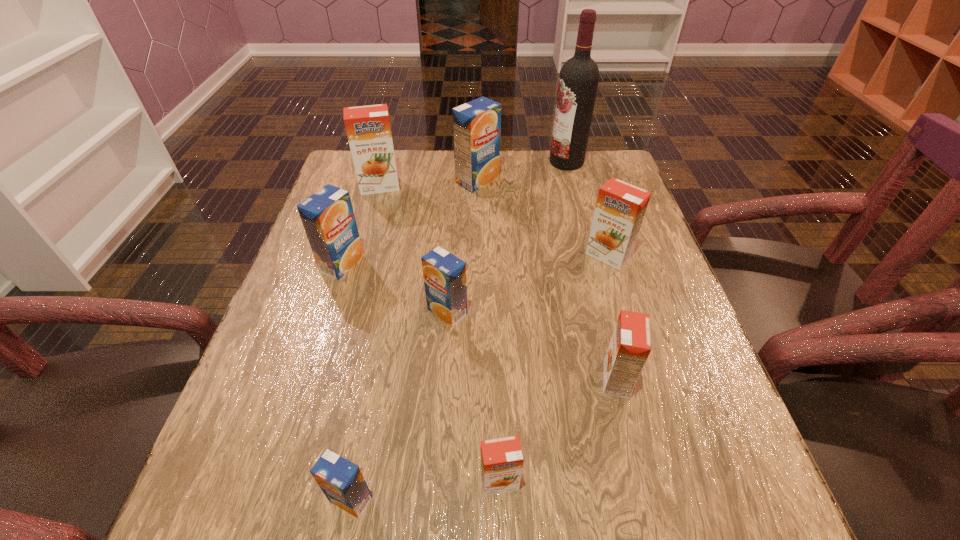
Identify the location of unoccupied area between the second blue orange_juice from left to right and the fourth nearest object. The image size is (960, 540). (399, 406).

Find the location of `free space between the smallest orange orange juice and the third smallest blue orange_juice`. free space between the smallest orange orange juice and the third smallest blue orange_juice is located at coordinates (420, 373).

I want to click on vacant space that's between the third farthest blue orange_juice and the biggest blue orange_juice, so click(x=463, y=246).

Where is `empty space that is in between the biggest orange orange juice and the third nearest blue orange_juice`? This screenshot has width=960, height=540. empty space that is in between the biggest orange orange juice and the third nearest blue orange_juice is located at coordinates (361, 225).

This screenshot has width=960, height=540. What are the coordinates of `vacant space in between the nearest orange orange juice and the second farthest blue orange_juice` in the screenshot? It's located at (420, 373).

This screenshot has height=540, width=960. I want to click on vacant region between the third blue orange_juice from right to left and the farthest blue orange_juice, so click(x=414, y=340).

The width and height of the screenshot is (960, 540). Identify the location of empty location between the third smallest orange orange juice and the third orange orange juice from right to left. (554, 369).

Locate which object ranks fifth in proximity to the fourth nearest orange juice. Please provide its 2D coordinates. Your answer should be formatted as a tuple, i.e. [(x, y)], where the tuple contains the x and y coordinates of a point satisfying the conditions above.

[(342, 482)]

Image resolution: width=960 pixels, height=540 pixels. Identify the location of object that is the fifth nearest to the biggest orange orange juice. point(620,208).

Image resolution: width=960 pixels, height=540 pixels. I want to click on orange juice that can be found as the closest to the biggest orange orange juice, so click(x=476, y=124).